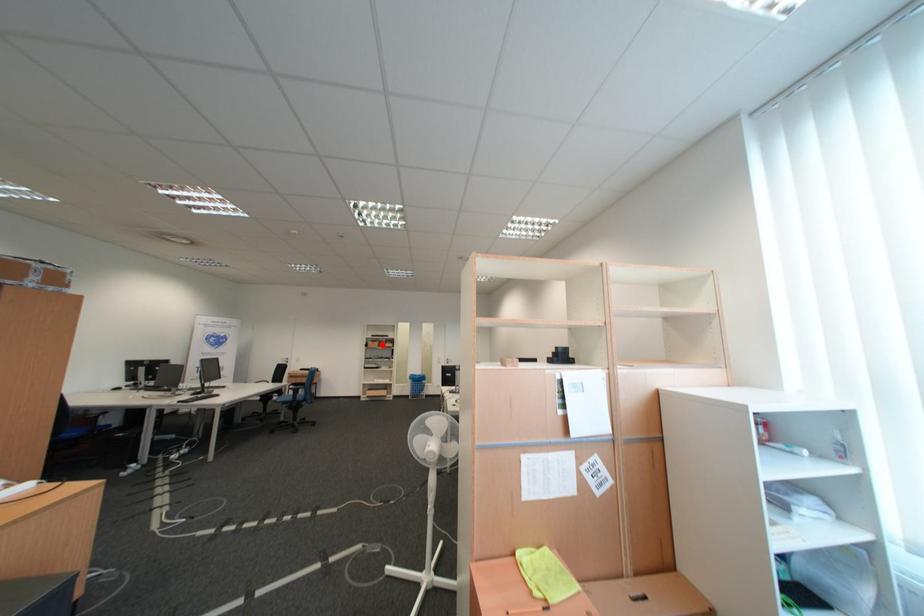
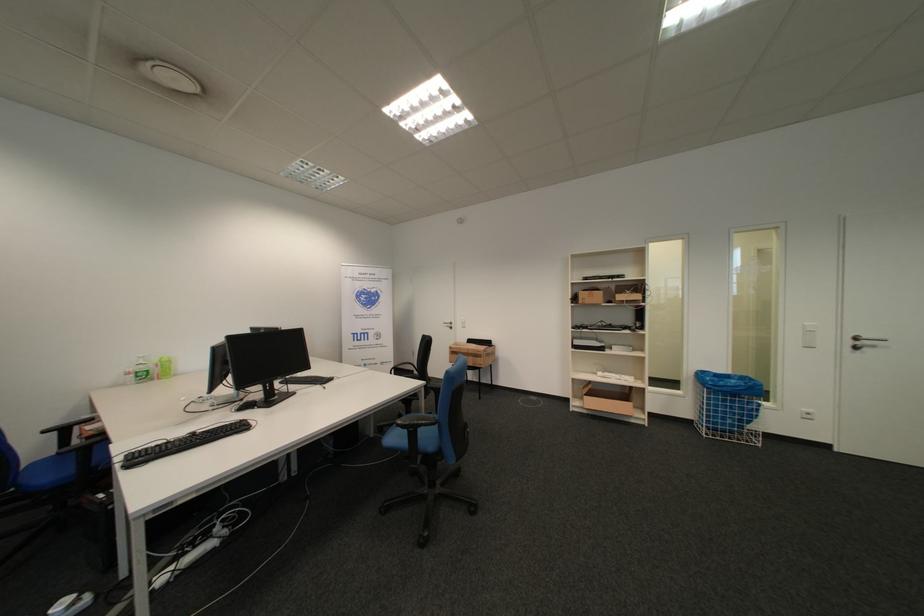
Question: I am providing you with two images of the same scene from different viewpoints. In image1, a red point is highlighted. Considering the same 3D point in image2, which of the following is correct?

Choices:
 (A) It is closer
 (B) It is farther

Answer: (A)